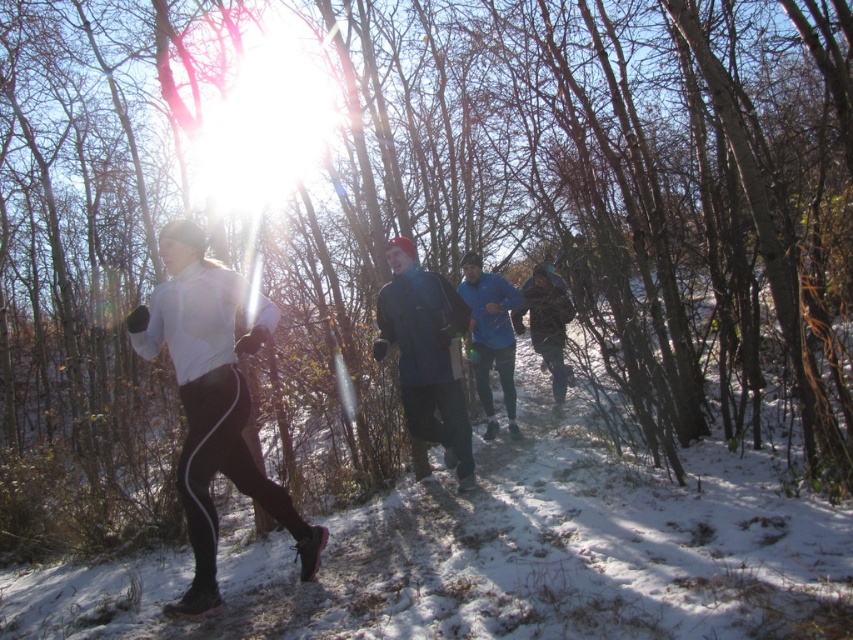
You are a photographer trying to capture the runners in the snowy trail. You notice two clothing items at the center of your viewfinder. Which clothing item would appear bigger in your photo, the white matte running suit at center or the blue fabric jacket at center?

The white matte running suit at center appears bigger in the photo because it has a larger size compared to the blue fabric jacket at center.